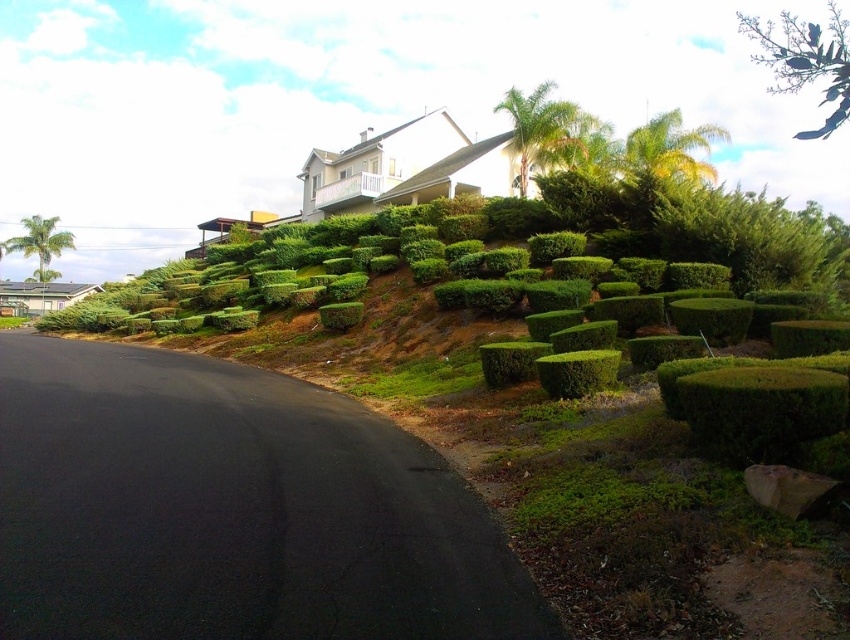
You are standing at the point marked by the coordinates point (672, 148) in the suburban scene. What object are you currently located on?

The point (672, 148) is on the yellowgreen leafy palm tree at upper right.

You are standing at the base of the hill in the suburban scene. You want to walk directly to the point marked at coordinates point (647, 140). How far will you have to walk in feet?

The point (647, 140) is 48.90 feet away from the viewer, so you will have to walk 48.90 feet to reach it.